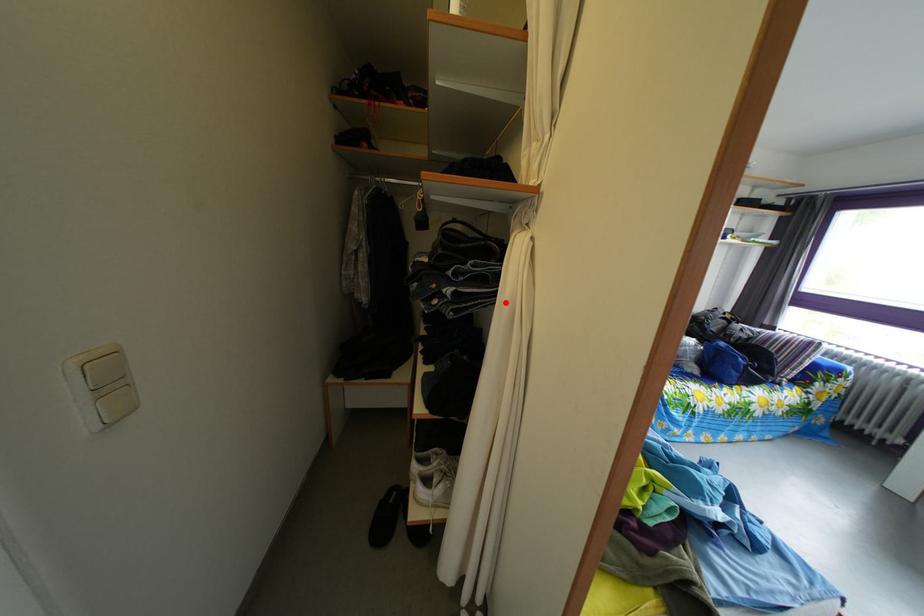
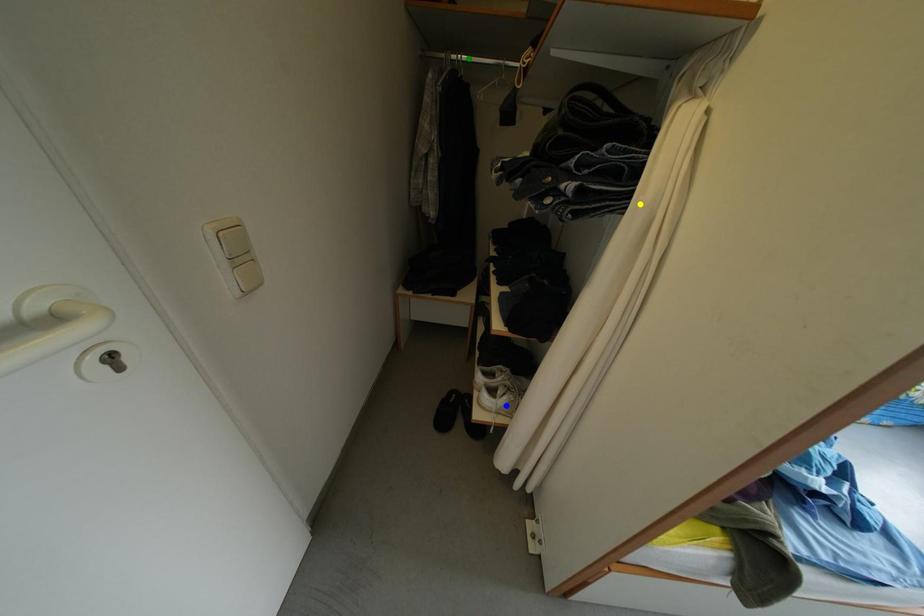
Question: I am providing you with two images of the same scene from different viewpoints. A red point is marked on the first image. You are given multiple points on the second image. In image 2, which mark is for the same physical point as the one in image 1?

Choices:
 (A) yellow point
 (B) green point
 (C) blue point

Answer: (A)